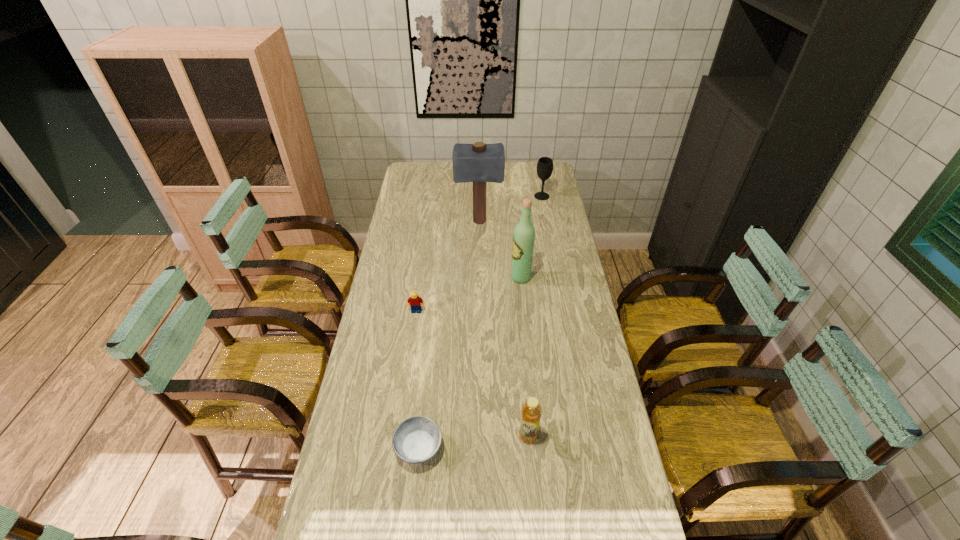
The image size is (960, 540). What are the coordinates of `vacant space at the right edge of the desktop` in the screenshot? It's located at (594, 394).

Find the location of a particular element. free space at the far left corner of the desktop is located at coordinates (431, 181).

Find the location of `vacant region between the third nearest object and the bottle`. vacant region between the third nearest object and the bottle is located at coordinates (472, 374).

Find the location of a particular element. The height and width of the screenshot is (540, 960). free space between the mallet and the shortest object is located at coordinates (448, 335).

The image size is (960, 540). Identify the location of vacant area that lies between the wine bottle and the bottle. (524, 357).

Where is `free area in between the third nearest object and the ashtray`? free area in between the third nearest object and the ashtray is located at coordinates (418, 380).

Locate an element on the screen. free spot between the wine bottle and the ashtray is located at coordinates (469, 363).

Where is `unoccupied area between the fourth nearest object and the fifth tallest object`? Image resolution: width=960 pixels, height=540 pixels. unoccupied area between the fourth nearest object and the fifth tallest object is located at coordinates (468, 294).

This screenshot has height=540, width=960. In order to click on unoccupied position between the bottle and the ashtray in this screenshot , I will do `click(473, 442)`.

This screenshot has height=540, width=960. Find the location of `vacant region between the second shortest object and the shortest object`. vacant region between the second shortest object and the shortest object is located at coordinates (418, 380).